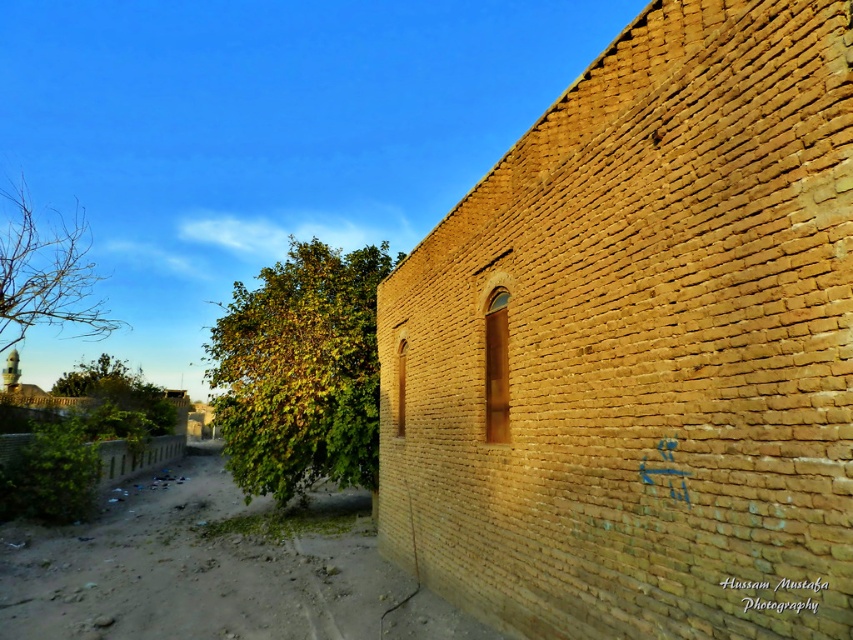
Does green leafy tree at center come in front of bare branches at upper left?

Yes.

Who is more forward, (271,486) or (82,230)?

Point (271,486)

Where is `green leafy tree at center`? The width and height of the screenshot is (853, 640). green leafy tree at center is located at coordinates (300, 371).

Which is below, dirt ground at lower left or brown wooden window at center?

dirt ground at lower left is lower down.

Which is behind, point (90, 593) or point (502, 397)?

The point (90, 593) is more distant.

Find the location of `dirt ground at lower left`. dirt ground at lower left is located at coordinates (213, 570).

Does yellow brick wall at right have a larger size compared to green leafy tree at lower left?

Actually, yellow brick wall at right might be smaller than green leafy tree at lower left.

Who is more forward, [700,33] or [112,413]?

Point [700,33]

At what (x,y) coordinates should I click in order to perform the action: click on yellow brick wall at right. Please return your answer as a coordinate pair (x, y). The width and height of the screenshot is (853, 640). Looking at the image, I should click on (643, 346).